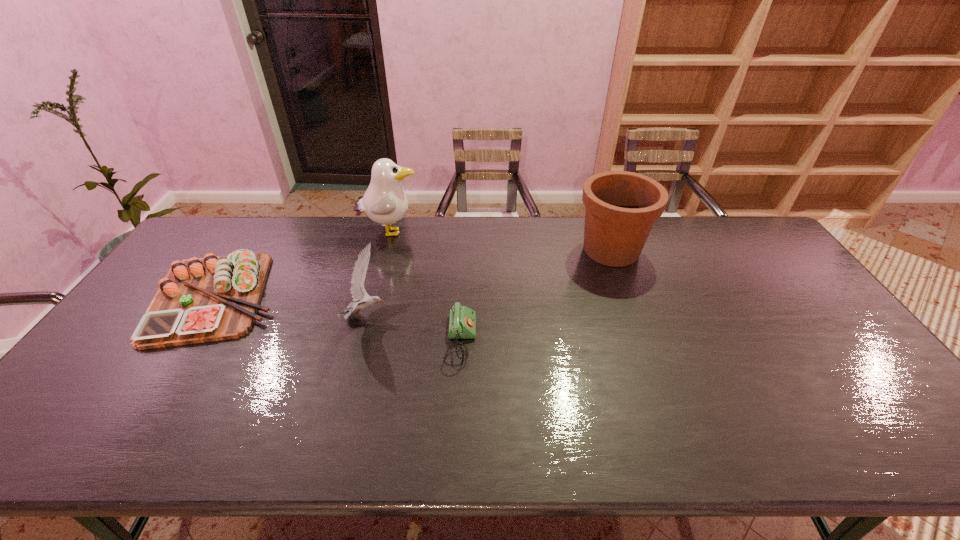
At what (x,y) coordinates should I click in order to perform the action: click on the taller gull. Please return your answer as a coordinate pair (x, y). The width and height of the screenshot is (960, 540). Looking at the image, I should click on (385, 202).

In order to click on the farther gull in this screenshot , I will do `click(385, 202)`.

Where is `the rightmost object`? the rightmost object is located at coordinates (621, 207).

Locate an element on the screen. the second tallest object is located at coordinates (621, 207).

This screenshot has height=540, width=960. Find the location of `the shorter gull`. the shorter gull is located at coordinates (358, 292).

I want to click on the third tallest object, so click(358, 292).

The height and width of the screenshot is (540, 960). In order to click on the second shortest object in this screenshot , I will do `click(207, 299)`.

You are a GUI agent. You are given a task and a screenshot of the screen. Output one action in this format:
    pyautogui.click(x=<x>, y=<y>)
    Task: Click on the leftmost object
    
    Given the screenshot: What is the action you would take?
    pyautogui.click(x=207, y=299)

Where is `the second object from right to left`? the second object from right to left is located at coordinates (462, 320).

The width and height of the screenshot is (960, 540). In order to click on the shortest object in this screenshot , I will do `click(462, 320)`.